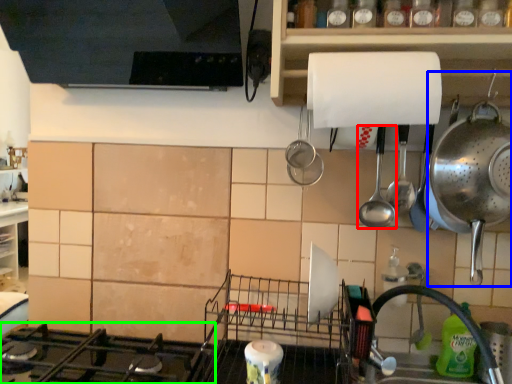
Question: Which object is the farthest from spoon (highlighted by a red box)? Choose among these: appliance (highlighted by a blue box) or gas stove (highlighted by a green box).

Choices:
 (A) appliance
 (B) gas stove

Answer: (B)